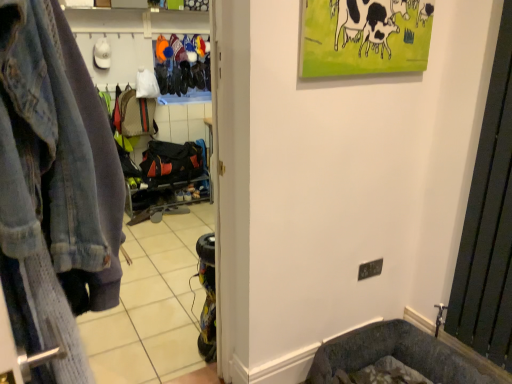
What is the approximate height of black metal radiator at right?

It is 38.63 inches.

In the scene shown: What is the approximate width of faded denim jacket at left?

5.57 inches.

Image resolution: width=512 pixels, height=384 pixels. Identify the location of faded denim jacket at left. (54, 191).

Is faded denim jacket at left facing towards faded denim jacket at left?

Yes, faded denim jacket at left is turned towards faded denim jacket at left.

Looking at this image, based on their sizes in the image, would you say faded denim jacket at left is bigger or smaller than faded denim jacket at left?

faded denim jacket at left is bigger than faded denim jacket at left.

Considering the positions of objects faded denim jacket at left and faded denim jacket at left in the image provided, who is more to the right, faded denim jacket at left or faded denim jacket at left?

Positioned to the right is faded denim jacket at left.

Locate an element on the screen. This screenshot has width=512, height=384. denim jacket lying in front of the faded denim jacket at left is located at coordinates (42, 147).

Can you confirm if faded denim jacket at left is thinner than black metal radiator at right?

No.

Is black metal radiator at right at the back of faded denim jacket at left?

No, faded denim jacket at left's orientation is not away from black metal radiator at right.

Considering the relative positions of faded denim jacket at left and black metal radiator at right in the image provided, is faded denim jacket at left to the left of black metal radiator at right from the viewer's perspective?

Correct, you'll find faded denim jacket at left to the left of black metal radiator at right.

Can you confirm if faded denim jacket at left is smaller than black metal radiator at right?

No.

Is point (468, 261) farther from viewer compared to point (12, 37)?

Yes, it is behind point (12, 37).

Which of these two, black metal radiator at right or faded denim jacket at left, is wider?

faded denim jacket at left.

Does black metal radiator at right have a greater height compared to faded denim jacket at left?

Yes, black metal radiator at right is taller than faded denim jacket at left.

The height and width of the screenshot is (384, 512). What are the coordinates of `denim jacket below the faded denim jacket at left (from the image's perspective)` in the screenshot? It's located at pyautogui.click(x=42, y=147).

How distant is faded denim jacket at left from faded denim jacket at left?

They are 6.09 centimeters apart.

Based on the photo, looking at the image, does faded denim jacket at left seem bigger or smaller compared to faded denim jacket at left?

Clearly, faded denim jacket at left is smaller in size than faded denim jacket at left.

Between faded denim jacket at left and faded denim jacket at left, which one appears on the right side from the viewer's perspective?

Positioned to the right is faded denim jacket at left.

Does black metal radiator at right touch faded denim jacket at left?

black metal radiator at right and faded denim jacket at left are clearly separated.

Could faded denim jacket at left be considered to be inside black metal radiator at right?

Actually, faded denim jacket at left is outside black metal radiator at right.

This screenshot has height=384, width=512. In order to click on screen door behind the faded denim jacket at left in this screenshot , I will do `click(489, 223)`.

Which is farther, (488,159) or (94,253)?

The point (488,159) is farther from the camera.

Based on their positions, is faded denim jacket at left located to the left or right of black metal radiator at right?

From the image, it's evident that faded denim jacket at left is to the left of black metal radiator at right.

Looking at the image, does faded denim jacket at left seem bigger or smaller compared to black metal radiator at right?

In the image, faded denim jacket at left appears to be larger than black metal radiator at right.

Who is shorter, faded denim jacket at left or black metal radiator at right?

Standing shorter between the two is faded denim jacket at left.

Choose the correct answer: Is faded denim jacket at left inside black metal radiator at right or outside it?

faded denim jacket at left is spatially situated outside black metal radiator at right.

Locate an element on the screen. Image resolution: width=512 pixels, height=384 pixels. denim jacket on the left of faded denim jacket at left is located at coordinates (42, 147).

You are a GUI agent. You are given a task and a screenshot of the screen. Output one action in this format:
    pyautogui.click(x=<x>, y=<y>)
    Task: Click on the screen door below the faded denim jacket at left (from a real-world perspective)
    The width and height of the screenshot is (512, 384).
    Given the screenshot: What is the action you would take?
    pyautogui.click(x=489, y=223)

When comparing their distances from black metal radiator at right, does faded denim jacket at left or faded denim jacket at left seem further?

faded denim jacket at left is positioned further to the anchor black metal radiator at right.

Considering their positions, is black metal radiator at right positioned closer to faded denim jacket at left than faded denim jacket at left?

Among the two, faded denim jacket at left is located nearer to faded denim jacket at left.

From the image, which object appears to be nearer to faded denim jacket at left, faded denim jacket at left or black metal radiator at right?

faded denim jacket at left is closer to faded denim jacket at left.

Looking at the image, which one is located closer to black metal radiator at right, faded denim jacket at left or faded denim jacket at left?

faded denim jacket at left lies closer to black metal radiator at right than the other object.

From the image, which object appears to be nearer to faded denim jacket at left, faded denim jacket at left or black metal radiator at right?

faded denim jacket at left is closer to faded denim jacket at left.

When comparing their distances from faded denim jacket at left, does black metal radiator at right or faded denim jacket at left seem further?

black metal radiator at right is positioned further to the anchor faded denim jacket at left.

Where is `clothing store located between faded denim jacket at left and black metal radiator at right in the left-right direction`? Image resolution: width=512 pixels, height=384 pixels. clothing store located between faded denim jacket at left and black metal radiator at right in the left-right direction is located at coordinates (54, 191).